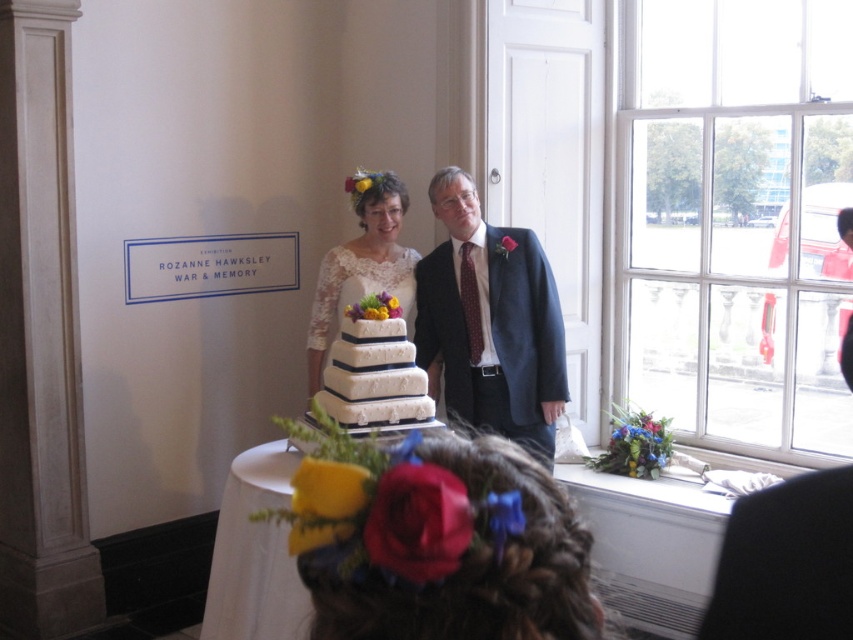
You are a photographer at the wedding. You need to decide whether to focus on the white textured cake at center or the white lace dress at center for a closeup shot. Which one is smaller and thus requires a closer focus to capture details?

The white textured cake at center is smaller than the white lace dress at center, so you should focus on the white textured cake at center for a closer focus to capture details.

You are a photographer trying to capture the perfect shot of the wedding couple. You notice two points marked on the image at coordinates point (399, 394) and point (358, 236). Which point is closer to the camera?

Point (399, 394) is in front of point (358, 236), so it is closer to the camera.